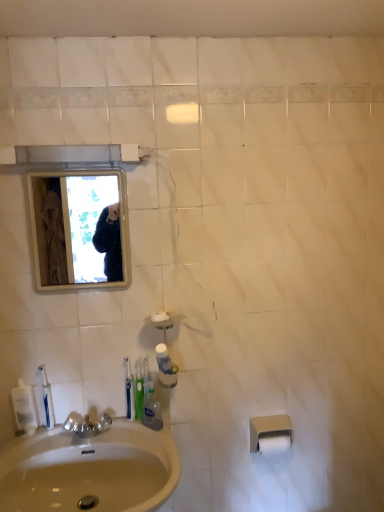
Question: Based on their positions, is green plastic toothbrush at sink, the second toothbrush in the left-to-right sequence, located to the left or right of beige matte toilet paper at lower right, positioned as the first toilet paper in top-to-bottom order?

Choices:
 (A) left
 (B) right

Answer: (A)

Question: Is point (135, 384) positioned closer to the camera than point (286, 435)?

Choices:
 (A) closer
 (B) farther

Answer: (A)

Question: Considering the real-world distances, which object is closest to the translucent plastic mouthwash at lower center, which is the 3th mouthwash from left to right?

Choices:
 (A) white matte soap at center
 (B) white glossy mirror at upper left
 (C) green plastic toothbrush at sink, the second toothbrush in the left-to-right sequence
 (D) white matte toilet paper at lower right, which appears as the second toilet paper when viewed from the top
 (E) white plastic toothbrush at lower left, which is the 2th toothbrush from right to left

Answer: (C)

Question: Which is farther from the green plastic toothbrush at sink, the first toothbrush when ordered from right to left?

Choices:
 (A) clear plastic mouthwash at lower left, the second mouthwash from the right
 (B) white matte soap at center
 (C) beige ceramic sink at lower left
 (D) clear plastic mouthwash at lower left, marked as the first mouthwash in a left-to-right arrangement
 (E) beige matte toilet paper at lower right, positioned as the first toilet paper in top-to-bottom order

Answer: (E)